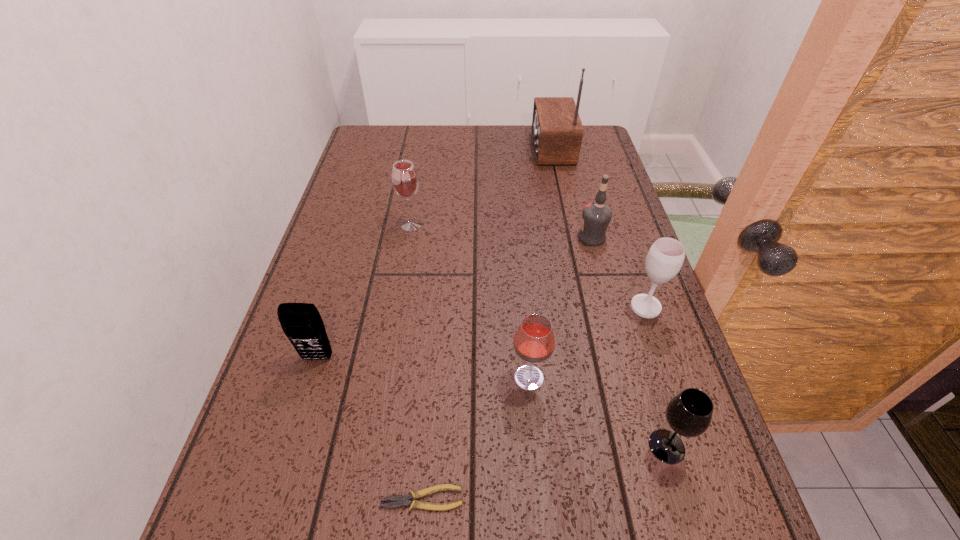
This screenshot has width=960, height=540. In order to click on pliers in this screenshot , I will do `click(401, 500)`.

I want to click on vacant area located on the front-facing side of the tallest object, so click(473, 148).

You are a GUI agent. You are given a task and a screenshot of the screen. Output one action in this format:
    pyautogui.click(x=<x>, y=<y>)
    Task: Click on the vacant area located on the front-facing side of the tallest object
    
    Given the screenshot: What is the action you would take?
    pyautogui.click(x=516, y=148)

Where is `free spot located 0.160m on the front-facing side of the tallest object`? The height and width of the screenshot is (540, 960). free spot located 0.160m on the front-facing side of the tallest object is located at coordinates (483, 148).

Find the location of a particular element. vacant space located on the front label of the vodka is located at coordinates (456, 237).

In order to click on vacant space situated 0.370m on the front label of the vodka in this screenshot , I will do `click(437, 237)`.

In order to click on vacant space located on the front label of the vodka in this screenshot , I will do `click(464, 237)`.

Where is `free space located on the back of the farthest wineglass`? The height and width of the screenshot is (540, 960). free space located on the back of the farthest wineglass is located at coordinates (416, 199).

Identify the location of vacant region located 0.140m on the back of the fourth farthest object. (628, 254).

The width and height of the screenshot is (960, 540). I want to click on vacant space positioned 0.110m on the right of the third wineglass from right to left, so click(604, 377).